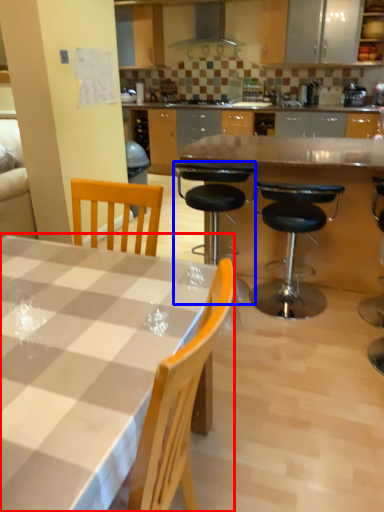
Question: Among these objects, which one is farthest to the camera, kitchen & dining room table (highlighted by a red box) or chair (highlighted by a blue box)?

Choices:
 (A) kitchen & dining room table
 (B) chair

Answer: (B)